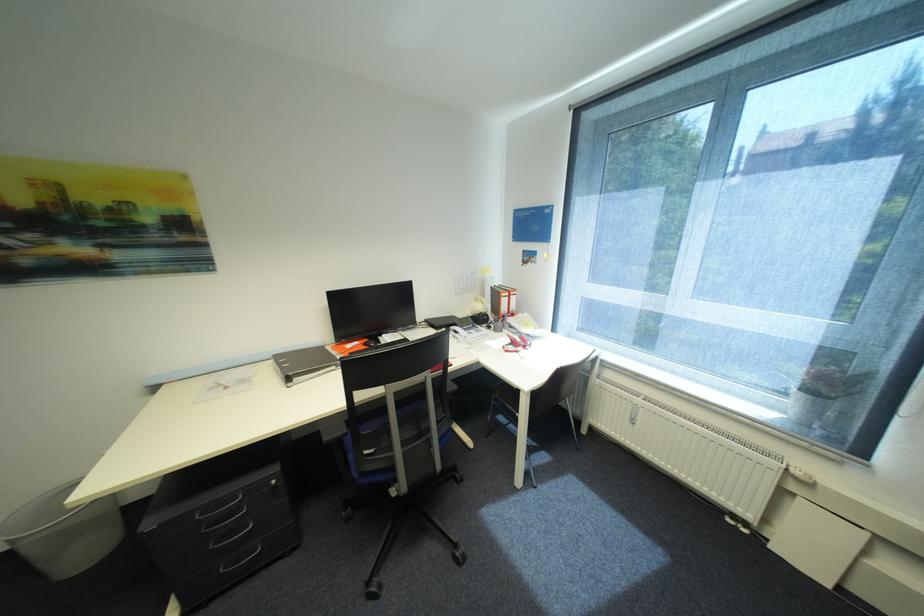
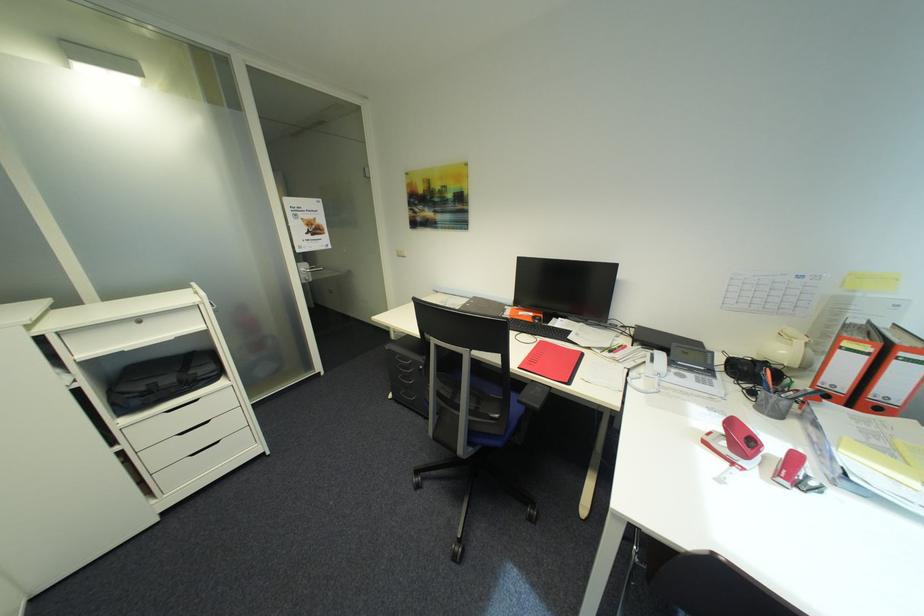
Where in the second image is the point corresponding to [515,299] from the first image?

(872, 359)